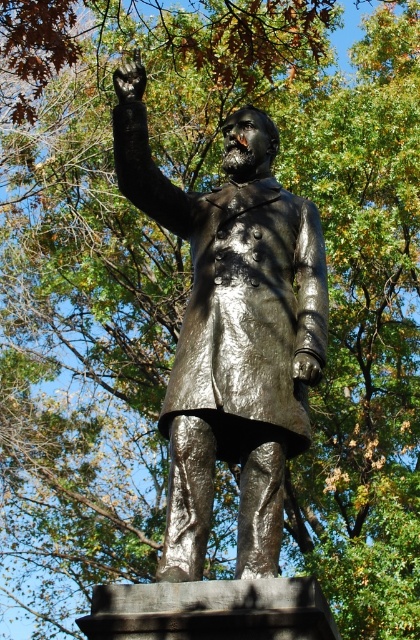
Question: Which point is farther from the camera taking this photo?

Choices:
 (A) (138, 90)
 (B) (178, 481)

Answer: (A)

Question: Which of the following is the farthest from the observer?

Choices:
 (A) (265, 385)
 (B) (126, 97)

Answer: (B)

Question: Can you confirm if shiny bronze statue at center is bigger than shiny black glove at upper center?

Choices:
 (A) yes
 (B) no

Answer: (B)

Question: Observing the image, what is the correct spatial positioning of shiny bronze statue at center in reference to shiny black glove at upper center?

Choices:
 (A) above
 (B) below

Answer: (B)

Question: Is the position of shiny bronze statue at center less distant than that of shiny black glove at upper center?

Choices:
 (A) yes
 (B) no

Answer: (A)